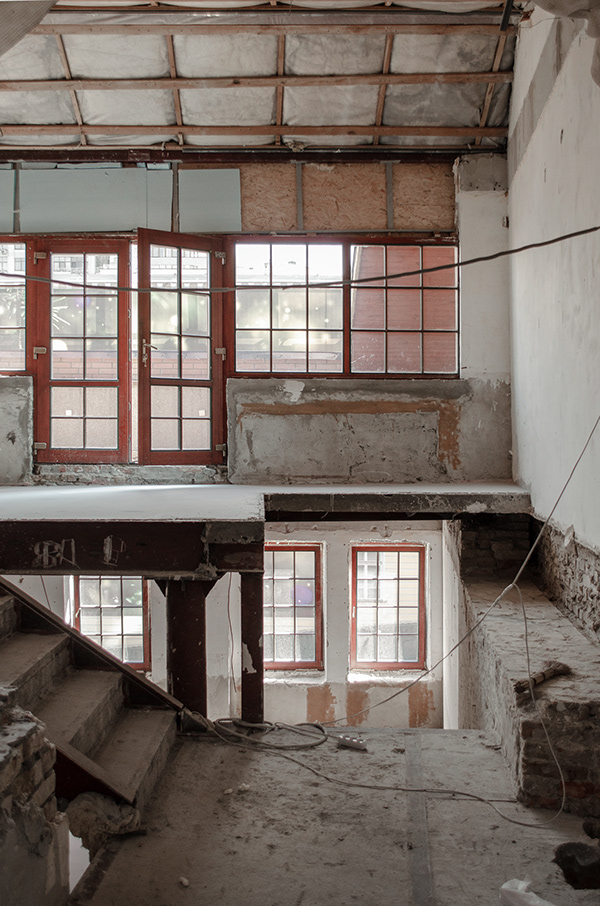
This screenshot has width=600, height=906. I want to click on wall, so click(x=586, y=391).